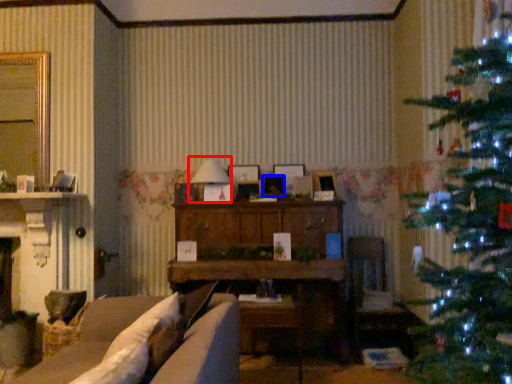
Question: Which point is closer to the camera, lamp (highlighted by a red box) or picture frame (highlighted by a blue box)?

Choices:
 (A) lamp
 (B) picture frame

Answer: (A)